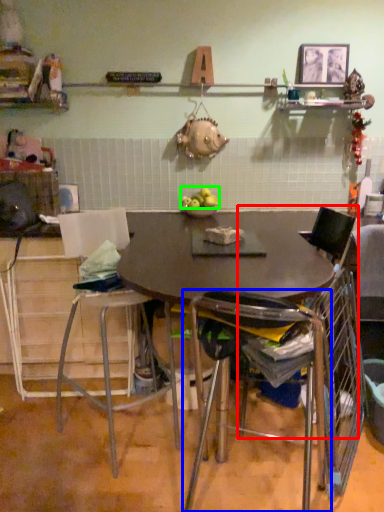
Question: Based on their relative distances, which object is nearer to chair (highlighted by a red box)? Choose from chair (highlighted by a blue box) and apple (highlighted by a green box).

Choices:
 (A) chair
 (B) apple

Answer: (A)